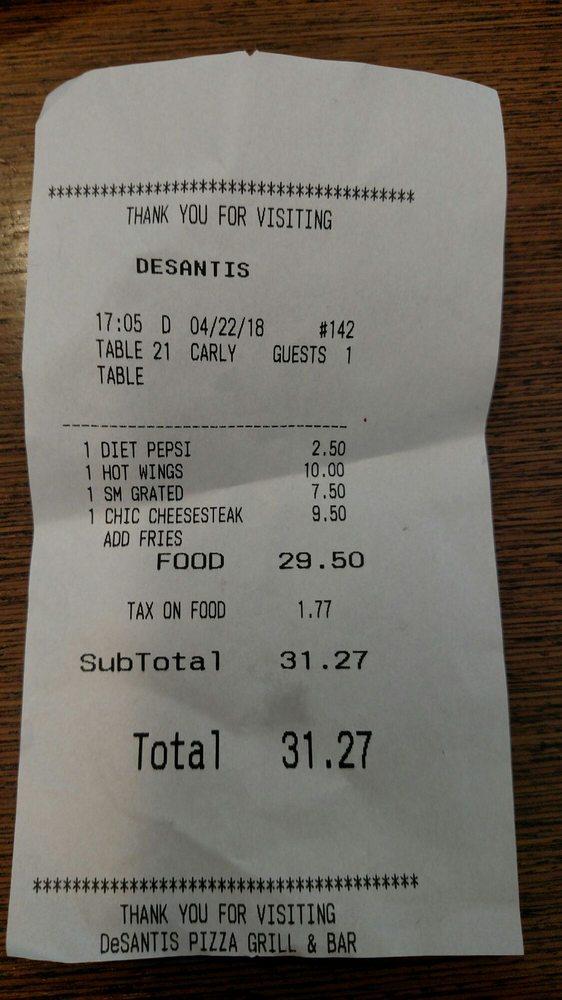
Find the location of `countertop`. countertop is located at coordinates (523, 676), (261, 978), (16, 532), (16, 931), (259, 34).